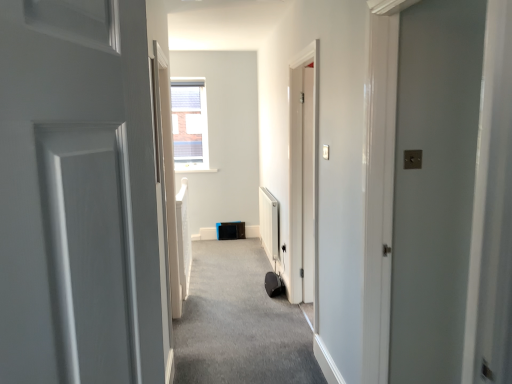
Question: Could you tell me if carpeted carpet at center is turned towards white glossy door at right?

Choices:
 (A) no
 (B) yes

Answer: (A)

Question: Is carpeted carpet at center to the left of white glossy door at right from the viewer's perspective?

Choices:
 (A) no
 (B) yes

Answer: (B)

Question: From the image's perspective, is carpeted carpet at center located beneath white glossy door at right?

Choices:
 (A) yes
 (B) no

Answer: (A)

Question: From a real-world perspective, is carpeted carpet at center positioned over white glossy door at right based on gravity?

Choices:
 (A) yes
 (B) no

Answer: (B)

Question: Does carpeted carpet at center lie behind white glossy door at right?

Choices:
 (A) no
 (B) yes

Answer: (B)

Question: Considering the relative sizes of carpeted carpet at center and white glossy door at right in the image provided, is carpeted carpet at center bigger than white glossy door at right?

Choices:
 (A) no
 (B) yes

Answer: (A)

Question: From a real-world perspective, is white glossy door at right physically above carpeted carpet at center?

Choices:
 (A) yes
 (B) no

Answer: (A)

Question: Is white glossy door at right positioned with its back to carpeted carpet at center?

Choices:
 (A) yes
 (B) no

Answer: (B)

Question: Does white glossy door at right touch carpeted carpet at center?

Choices:
 (A) no
 (B) yes

Answer: (A)

Question: Considering the relative positions of white glossy door at right and carpeted carpet at center in the image provided, is white glossy door at right in front of carpeted carpet at center?

Choices:
 (A) yes
 (B) no

Answer: (A)

Question: Is white glossy door at right not inside carpeted carpet at center?

Choices:
 (A) no
 (B) yes

Answer: (B)

Question: Is white glossy door at right facing towards carpeted carpet at center?

Choices:
 (A) yes
 (B) no

Answer: (B)

Question: Is point (182, 347) positioned closer to the camera than point (467, 23)?

Choices:
 (A) closer
 (B) farther

Answer: (B)